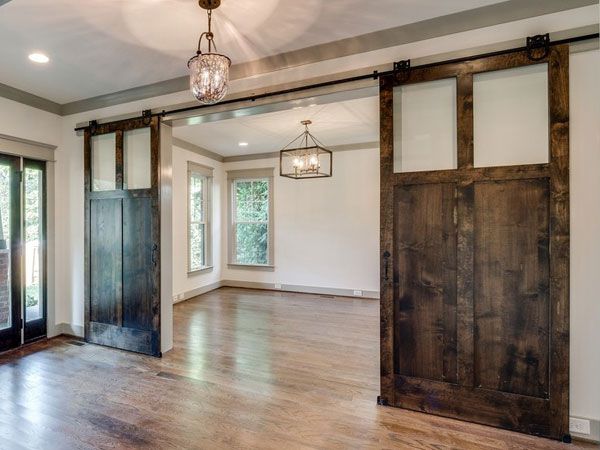
Where is `white walls`? white walls is located at coordinates (339, 223), (73, 171), (591, 247).